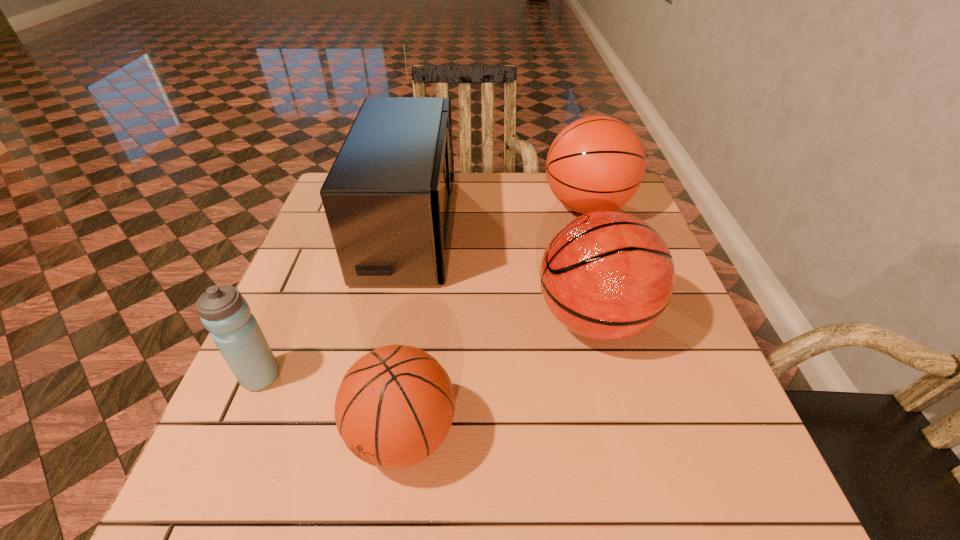
In the image, there is a desktop. In order to click on blank space at the far edge in this screenshot , I will do `click(486, 179)`.

Locate an element on the screen. The image size is (960, 540). free space at the near edge is located at coordinates (420, 520).

In the image, there is a desktop. In order to click on vacant space at the left edge in this screenshot , I will do `click(309, 366)`.

In the image, there is a desktop. Find the location of `blank space at the right edge`. blank space at the right edge is located at coordinates (693, 328).

Image resolution: width=960 pixels, height=540 pixels. I want to click on vacant space that is in between the microwave_oven and the second nearest basketball, so click(501, 273).

The width and height of the screenshot is (960, 540). I want to click on empty space between the second nearest basketball and the leftmost object, so click(x=427, y=348).

Locate an element on the screen. The image size is (960, 540). empty space that is in between the leftmost basketball and the farthest basketball is located at coordinates (495, 321).

At what (x,y) coordinates should I click in order to perform the action: click on empty location between the shortest object and the second nearest basketball. Please return your answer as a coordinate pair (x, y). The width and height of the screenshot is (960, 540). Looking at the image, I should click on (498, 377).

Identify the location of free space between the farthest basketball and the shortest basketball. This screenshot has width=960, height=540. (495, 321).

The image size is (960, 540). I want to click on free space between the leftmost object and the nearest basketball, so click(x=332, y=406).